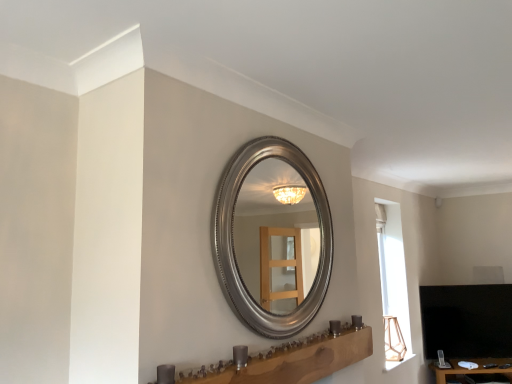
Question: Considering the positions of point 467,372 and point 344,349, is point 467,372 closer or farther from the camera than point 344,349?

Choices:
 (A) closer
 (B) farther

Answer: (B)

Question: Is wooden table at lower right to the left or to the right of wooden vanity at lower center in the image?

Choices:
 (A) left
 (B) right

Answer: (B)

Question: Looking at the image, does wooden table at lower right seem bigger or smaller compared to wooden vanity at lower center?

Choices:
 (A) small
 (B) big

Answer: (B)

Question: Visually, is wooden vanity at lower center positioned to the left or to the right of wooden table at lower right?

Choices:
 (A) right
 (B) left

Answer: (B)

Question: In the image, is wooden vanity at lower center positioned in front of or behind wooden table at lower right?

Choices:
 (A) behind
 (B) front

Answer: (B)

Question: From a real-world perspective, is wooden vanity at lower center above or below wooden table at lower right?

Choices:
 (A) above
 (B) below

Answer: (A)

Question: From the image's perspective, is wooden vanity at lower center above or below wooden table at lower right?

Choices:
 (A) below
 (B) above

Answer: (B)